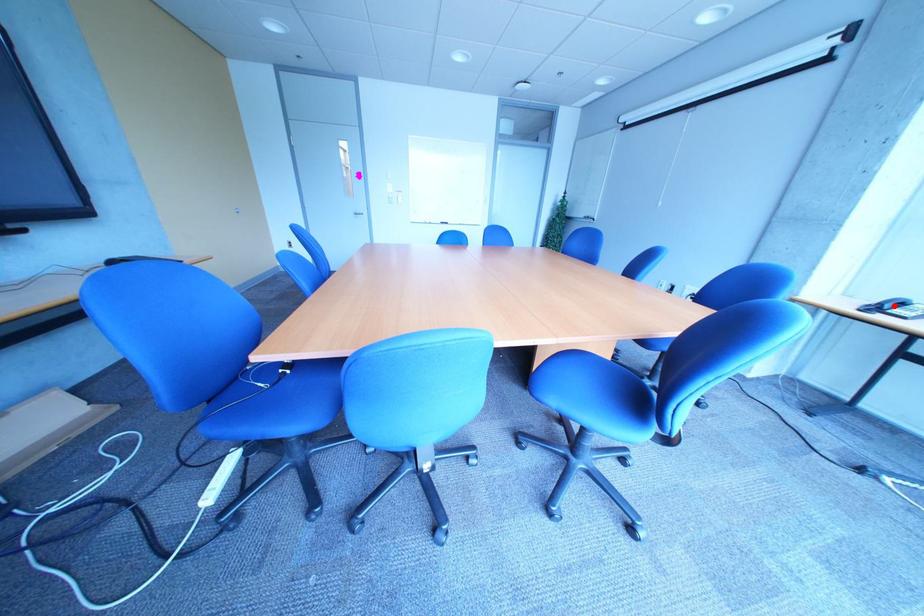
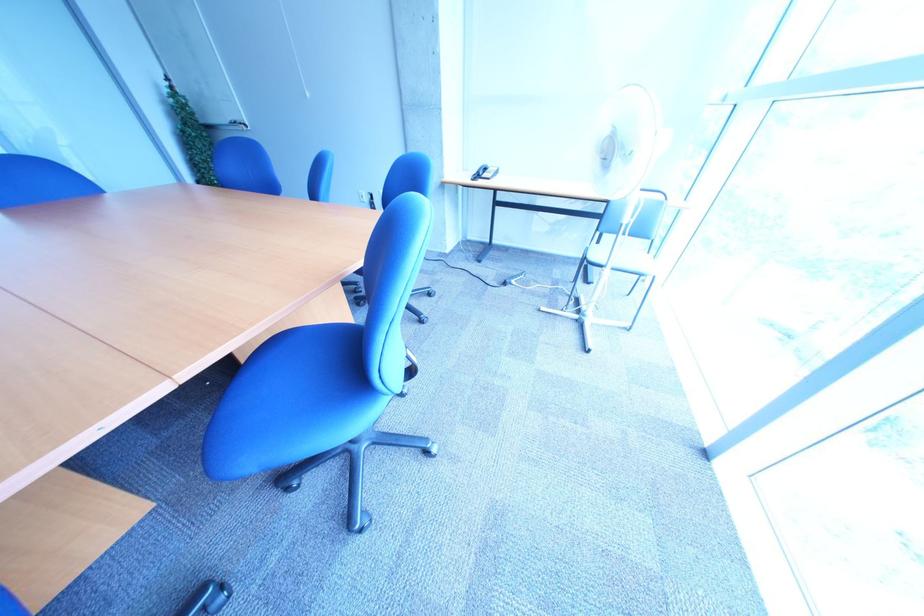
Question: I am providing you with two images of the same scene from different viewpoints. Given a red point in image1, look at the same physical point in image2. Is it:

Choices:
 (A) Closer to the viewpoint
 (B) Farther from the viewpoint

Answer: (A)